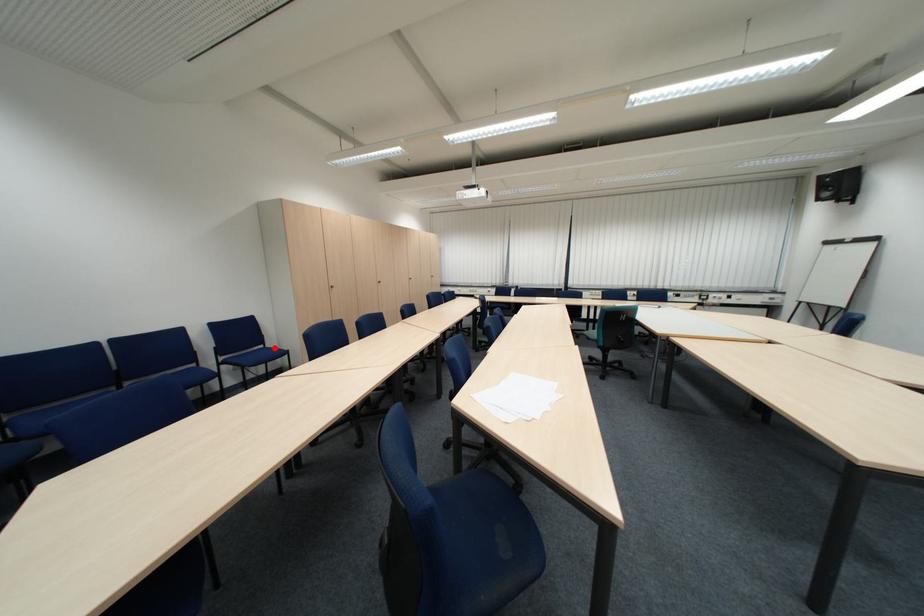
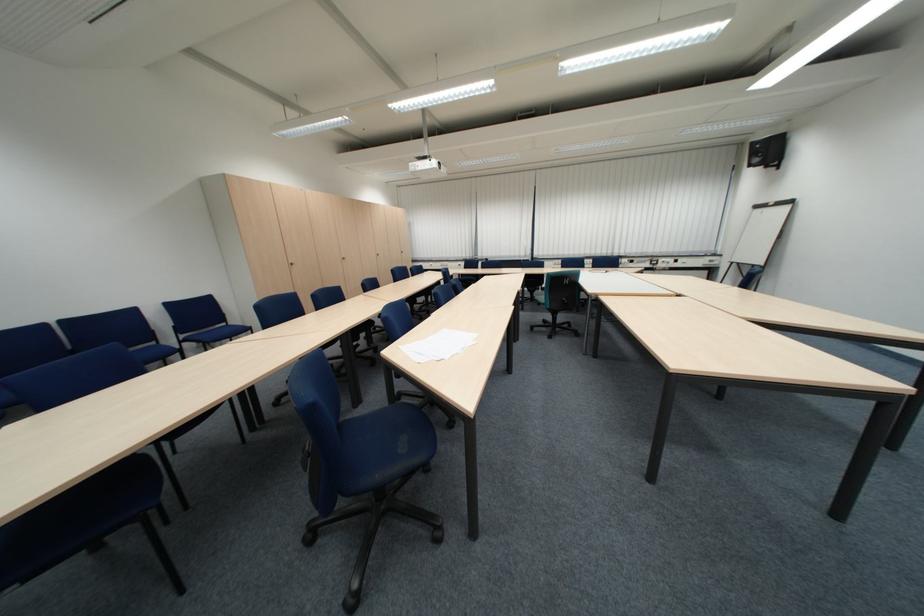
Find the pixel in the second image that matches the highlighted location in the first image.

(237, 326)